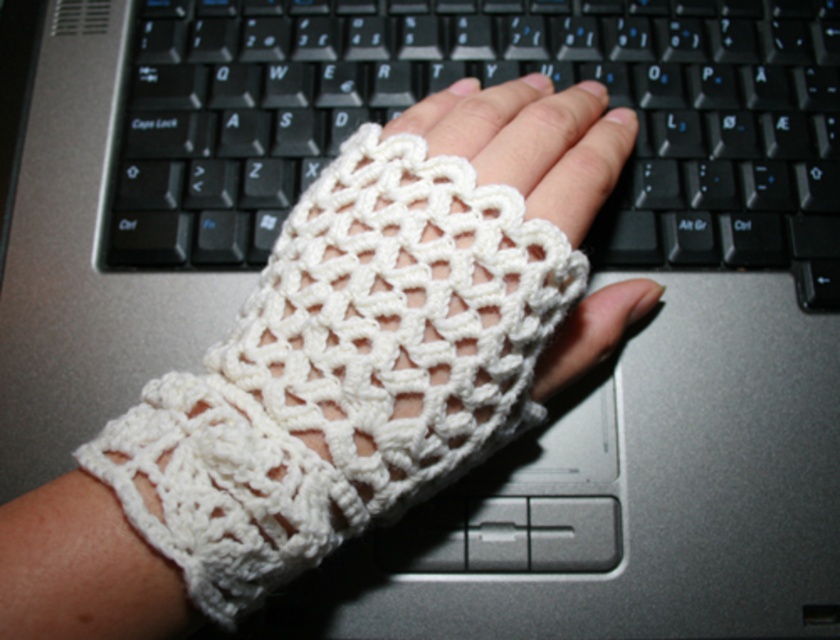
You are trying to type on the laptop keyboard while wearing the white crochet fingerless glove at center. Can you reach the keys on the black plastic keyboard at center without moving your hand?

The black plastic keyboard at center is positioned on the left side of the white crochet fingerless glove at center, so yes, you can reach the keys on the black plastic keyboard at center without moving your hand since it is within reach of the glove.

You are trying to type on the keyboard but your hand is blocking the view. Which object is closer to you, the black plastic keyboard at center or the white crochet fingerless glove at center?

The black plastic keyboard at center is closer to you than the white crochet fingerless glove at center, so you can type without moving your hand since the keyboard is in front.

You are a photographer setting up a shot of the black plastic keyboard at center. The camera is positioned at a certain distance. If the camera needs to focus on the keyboard clearly, what is the minimum distance the camera should be from the keyboard?

The black plastic keyboard at center is 28.93 inches from camera, so the camera should be at least 28.93 inches away to focus clearly.